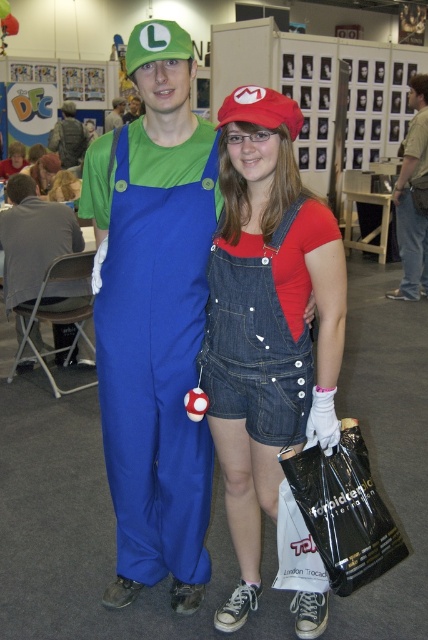
Does gray fabric pants at right have a greater width compared to matte green fabric luigi hat at upper center?

Indeed, gray fabric pants at right has a greater width compared to matte green fabric luigi hat at upper center.

Who is positioned more to the right, gray fabric pants at right or matte green fabric luigi hat at upper center?

Positioned to the right is gray fabric pants at right.

Locate an element on the screen. This screenshot has width=428, height=640. gray fabric pants at right is located at coordinates (x=413, y=198).

Is point (214, 429) less distant than point (79, 186)?

Yes, point (214, 429) is in front of point (79, 186).

Does denim overalls at center have a larger size compared to denim shorts at center?

Correct, denim overalls at center is larger in size than denim shorts at center.

Does point (276, 264) lie in front of point (74, 188)?

Yes, point (276, 264) is in front of point (74, 188).

This screenshot has height=640, width=428. I want to click on denim overalls at center, so click(267, 321).

Is point (113, 369) closer to viewer compared to point (67, 193)?

Yes, point (113, 369) is in front of point (67, 193).

Is blue cotton overalls at center in front of denim shorts at center?

That is True.

Who is more forward, (163, 156) or (74, 196)?

Point (163, 156)

Where is `blue cotton overalls at center`? blue cotton overalls at center is located at coordinates (163, 333).